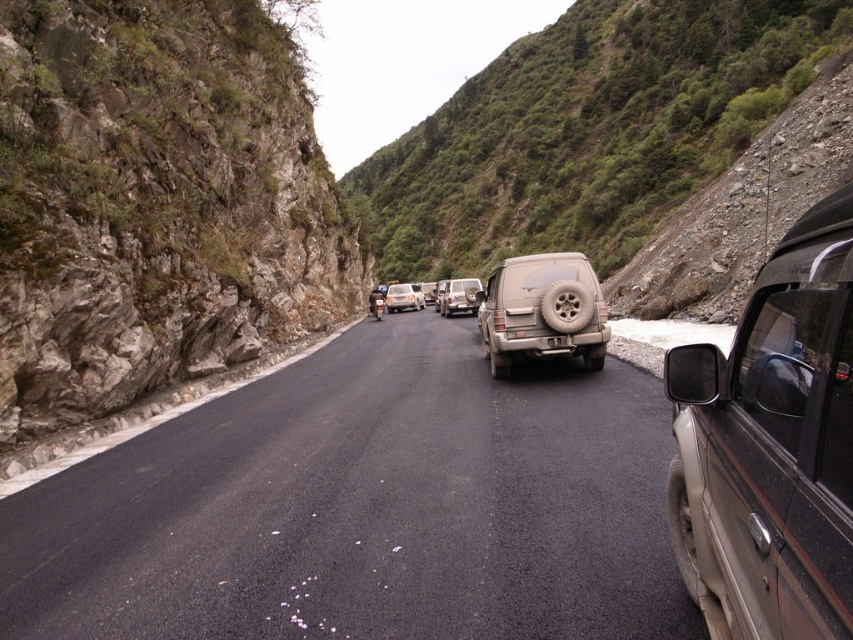
Is black asphalt road at center taller than asphalt road at left?

Incorrect, black asphalt road at center's height is not larger of asphalt road at left's.

Is point (338, 429) less distant than point (347, 323)?

Yes.

The height and width of the screenshot is (640, 853). I want to click on black asphalt road at center, so click(364, 508).

Measure the distance between matte black suv at right and matte gray suv at center.

matte black suv at right is 18.68 feet from matte gray suv at center.

Between point (822, 202) and point (537, 333), which one is positioned behind?

The point (822, 202) is more distant.

Locate an element on the screen. Image resolution: width=853 pixels, height=640 pixels. matte black suv at right is located at coordinates (770, 445).

Who is more forward, [161,364] or [392,285]?

Point [161,364] is more forward.

Who is more forward, (61,237) or (390,291)?

Point (61,237) is more forward.

Identify the location of rocky cliff at left. The width and height of the screenshot is (853, 640). (155, 204).